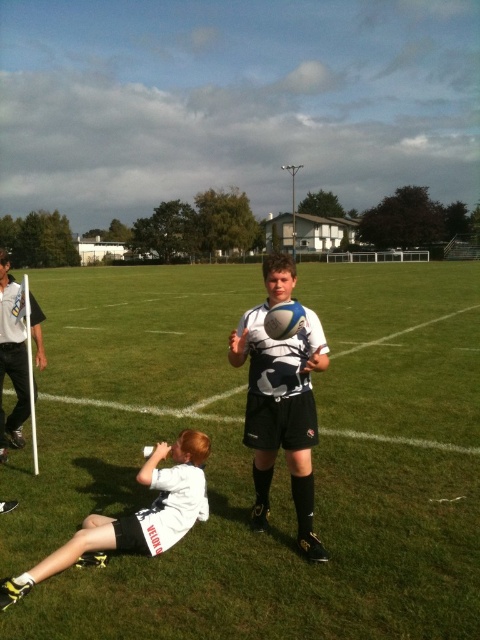
You are a referee on the sports field and need to retrieve an object. You see the white matte water bottle at lower left and the white plastic flag at left. Which object is nearer to you?

The white matte water bottle at lower left is closer to the viewer than the white plastic flag at left.

You are a referee on the field and need to place a 15cm wide marker between the white matte water bottle at lower left and the white plastic flag at left. Can the space between them accommodate the marker?

The white matte water bottle at lower left has a lesser width compared to white plastic flag at left. Since the water bottle is narrower, the space between them may be sufficient to place the 15cm wide marker, but the exact distance isn

You are a referee in a rugby match and need to determine if the white matte rugby ball at center is within the playing area. The playing area is marked by the white plastic flag at left. Is the ball closer to the flag than 5 meters?

The white matte rugby ball at center is closer to the viewer than the white plastic flag at left, but the exact distance between them isn not specified. Without knowing the actual distance, I cannot confirm if it is within 5 meters.